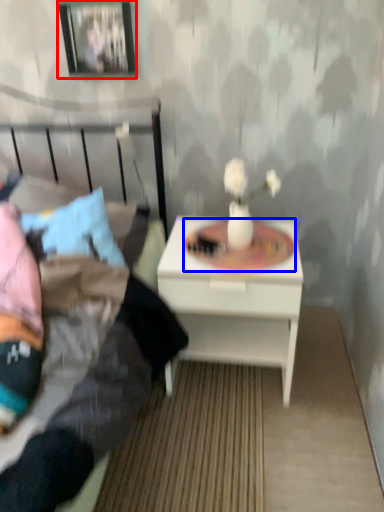
Question: Which object appears closest to the camera in this image, picture frame (highlighted by a red box) or round table (highlighted by a blue box)?

Choices:
 (A) picture frame
 (B) round table

Answer: (B)